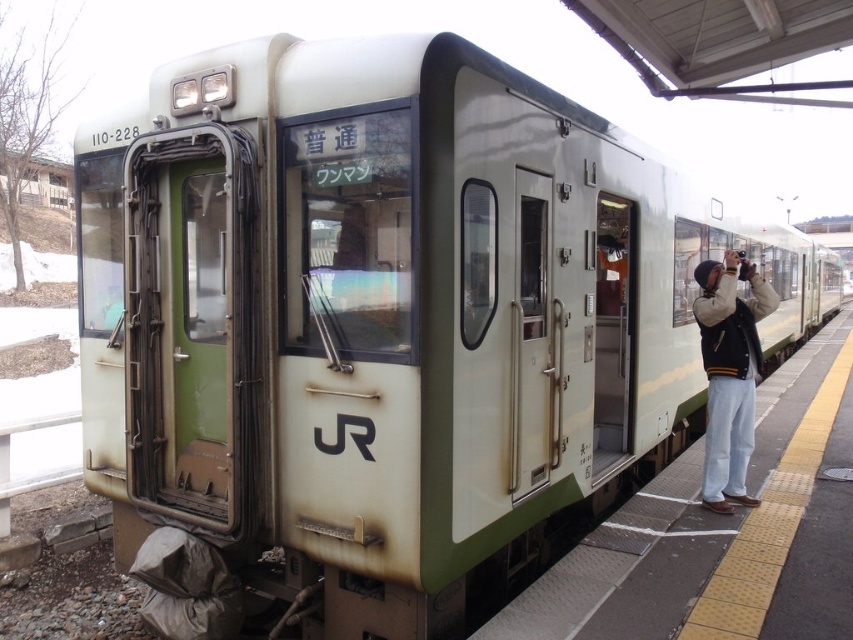
Question: Does smooth concrete platform at right lie in front of khaki wool jacket at right?

Choices:
 (A) no
 (B) yes

Answer: (B)

Question: Which of the following is the closest to the observer?

Choices:
 (A) khaki wool jacket at right
 (B) smooth concrete platform at right

Answer: (B)

Question: From the image, what is the correct spatial relationship of smooth concrete platform at right in relation to khaki wool jacket at right?

Choices:
 (A) above
 (B) below

Answer: (B)

Question: Does smooth concrete platform at right appear under khaki wool jacket at right?

Choices:
 (A) no
 (B) yes

Answer: (B)

Question: Which point appears farthest from the camera in this image?

Choices:
 (A) (737, 346)
 (B) (784, 404)

Answer: (B)